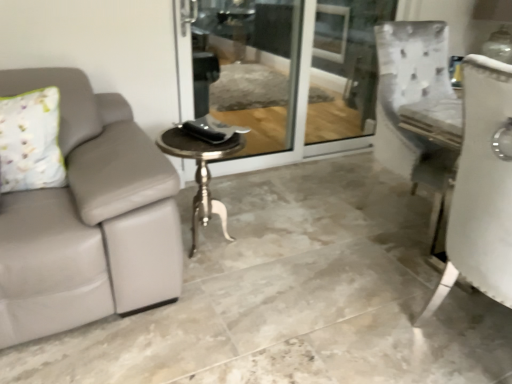
Question: Would you say gray leather couch at left is outside floral fabric pillow at left?

Choices:
 (A) yes
 (B) no

Answer: (A)

Question: Is gray leather couch at left far from floral fabric pillow at left?

Choices:
 (A) yes
 (B) no

Answer: (B)

Question: Considering the relative sizes of gray leather couch at left and floral fabric pillow at left in the image provided, is gray leather couch at left taller than floral fabric pillow at left?

Choices:
 (A) no
 (B) yes

Answer: (A)

Question: Is gray leather couch at left at the right side of floral fabric pillow at left?

Choices:
 (A) no
 (B) yes

Answer: (B)

Question: Is gray leather couch at left facing away from floral fabric pillow at left?

Choices:
 (A) no
 (B) yes

Answer: (A)

Question: Does gray leather couch at left have a lesser height compared to floral fabric pillow at left?

Choices:
 (A) yes
 (B) no

Answer: (A)

Question: Is gray leather couch at left not near polished silver table at center?

Choices:
 (A) yes
 (B) no

Answer: (B)

Question: Is gray leather couch at left looking in the opposite direction of polished silver table at center?

Choices:
 (A) no
 (B) yes

Answer: (A)

Question: Is gray leather couch at left not within polished silver table at center?

Choices:
 (A) yes
 (B) no

Answer: (A)

Question: Are gray leather couch at left and polished silver table at center making contact?

Choices:
 (A) yes
 (B) no

Answer: (B)

Question: Considering the relative sizes of gray leather couch at left and polished silver table at center in the image provided, is gray leather couch at left smaller than polished silver table at center?

Choices:
 (A) yes
 (B) no

Answer: (B)

Question: From the image's perspective, would you say gray leather couch at left is positioned over polished silver table at center?

Choices:
 (A) no
 (B) yes

Answer: (B)

Question: Considering the relative positions of polished silver table at center and clear glass screen door at center in the image provided, is polished silver table at center to the right of clear glass screen door at center from the viewer's perspective?

Choices:
 (A) no
 (B) yes

Answer: (A)